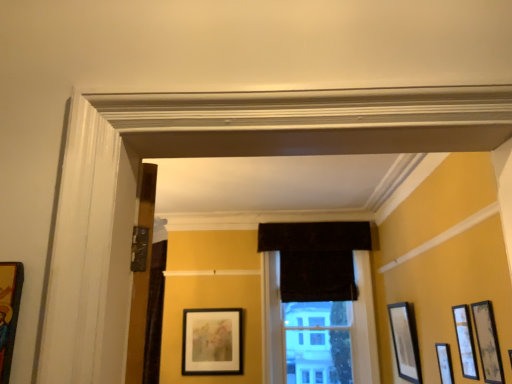
Question: Can we say matte black picture frame at center, which ranks as the second picture frame in left-to-right order, lies outside wooden framed picture at right, the second picture frame from the front?

Choices:
 (A) no
 (B) yes

Answer: (B)

Question: Considering the relative positions of matte black picture frame at center, the sixth picture frame viewed from the front, and wooden framed picture at right, which is counted as the 5th picture frame, starting from the back, in the image provided, is matte black picture frame at center, the sixth picture frame viewed from the front, to the left of wooden framed picture at right, which is counted as the 5th picture frame, starting from the back, from the viewer's perspective?

Choices:
 (A) no
 (B) yes

Answer: (B)

Question: Can you confirm if matte black picture frame at center, which ranks as the second picture frame in left-to-right order, is wider than wooden framed picture at right, which appears as the 3th picture frame when viewed from the left?

Choices:
 (A) yes
 (B) no

Answer: (A)

Question: From the image's perspective, is matte black picture frame at center, arranged as the first picture frame when viewed from the back, under wooden framed picture at right, which is counted as the 5th picture frame, starting from the back?

Choices:
 (A) no
 (B) yes

Answer: (B)

Question: Is matte black picture frame at center, which ranks as the second picture frame in left-to-right order, aimed at wooden framed picture at right, which appears as the 3th picture frame when viewed from the left?

Choices:
 (A) no
 (B) yes

Answer: (A)

Question: Is the position of matte black picture frame at center, the sixth picture frame viewed from the front, more distant than that of wooden framed picture at right, which is counted as the 5th picture frame, starting from the back?

Choices:
 (A) yes
 (B) no

Answer: (A)

Question: Does matte black picture frame at center, the sixth picture frame viewed from the front, lie behind matte black picture frame at right, the fourth picture frame viewed from the front?

Choices:
 (A) no
 (B) yes

Answer: (B)

Question: Considering the relative positions of matte black picture frame at center, arranged as the first picture frame when viewed from the back, and matte black picture frame at right, the third picture frame from the back, in the image provided, is matte black picture frame at center, arranged as the first picture frame when viewed from the back, to the right of matte black picture frame at right, the third picture frame from the back, from the viewer's perspective?

Choices:
 (A) no
 (B) yes

Answer: (A)

Question: From a real-world perspective, does matte black picture frame at center, which ranks as the second picture frame in left-to-right order, sit lower than matte black picture frame at right, the fourth picture frame viewed from the front?

Choices:
 (A) no
 (B) yes

Answer: (A)

Question: Can you confirm if matte black picture frame at center, the sixth picture frame viewed from the front, is thinner than matte black picture frame at right, the third picture frame from the back?

Choices:
 (A) yes
 (B) no

Answer: (B)

Question: Is matte black picture frame at center, the sixth picture frame viewed from the front, bigger than matte black picture frame at right, the fourth picture frame viewed from the front?

Choices:
 (A) no
 (B) yes

Answer: (B)

Question: Is matte black picture frame at center, which ranks as the second picture frame in left-to-right order, aimed at matte black picture frame at right, the 2th picture frame when ordered from right to left?

Choices:
 (A) no
 (B) yes

Answer: (A)

Question: Considering the relative sizes of velvet dark brown curtain at center and matte black picture frame at center, arranged as the first picture frame when viewed from the back, in the image provided, is velvet dark brown curtain at center thinner than matte black picture frame at center, arranged as the first picture frame when viewed from the back,?

Choices:
 (A) no
 (B) yes

Answer: (A)